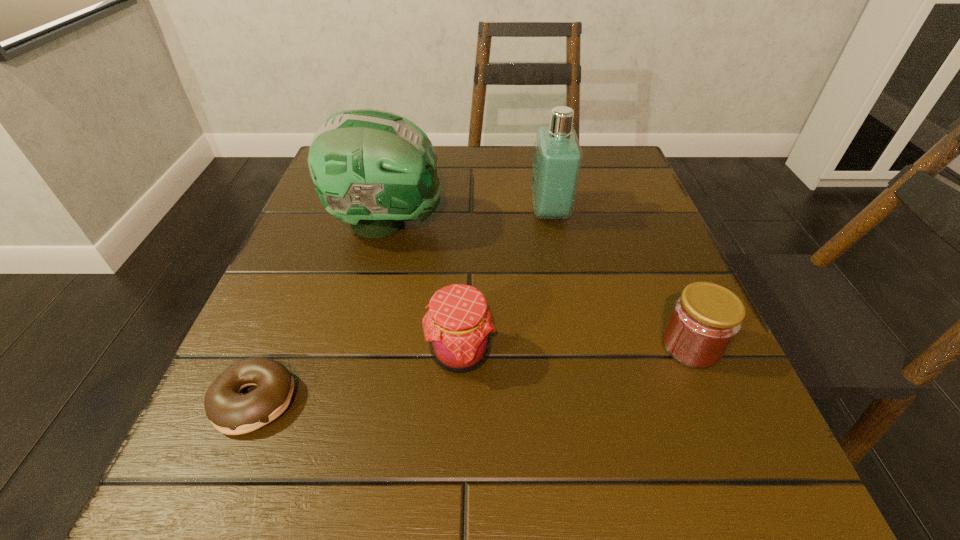
Where is `vacant region located on the left of the rightmost object`? vacant region located on the left of the rightmost object is located at coordinates (441, 346).

The image size is (960, 540). I want to click on vacant position located on the right of the doughnut, so click(486, 400).

Where is `football helmet located at the far edge`? The height and width of the screenshot is (540, 960). football helmet located at the far edge is located at coordinates (373, 169).

This screenshot has height=540, width=960. Identify the location of perfume at the far edge. (557, 161).

Where is `football helmet present at the left edge`? The image size is (960, 540). football helmet present at the left edge is located at coordinates (373, 169).

Identify the location of doughnut at the left edge. pos(230,412).

Where is `object at the right edge`? Image resolution: width=960 pixels, height=540 pixels. object at the right edge is located at coordinates (705, 319).

Where is `object at the far left corner`? The height and width of the screenshot is (540, 960). object at the far left corner is located at coordinates (373, 169).

The height and width of the screenshot is (540, 960). In order to click on blank area at the far edge in this screenshot , I will do `click(442, 153)`.

In the image, there is a desktop. Identify the location of vacant area at the near edge. (510, 487).